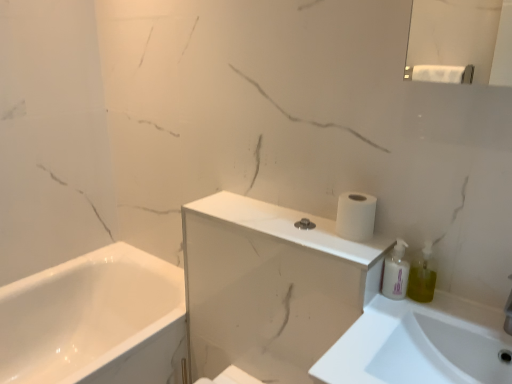
This screenshot has height=384, width=512. What do you see at coordinates (396, 273) in the screenshot?
I see `white glossy pump bottle at right` at bounding box center [396, 273].

Identify the location of white matte toilet paper at upper right. (355, 216).

What do you see at coordinates (270, 287) in the screenshot? I see `white glossy medicine cabinet at upper center` at bounding box center [270, 287].

Where is `white glossy medicine cabinet at upper center`? white glossy medicine cabinet at upper center is located at coordinates (270, 287).

Measure the distance between green translucent soap dispenser at right and camera.

They are 1.10 meters apart.

Locate an element on the screen. white glossy sink at lower right is located at coordinates (419, 344).

Where is `white glossy pump bottle at right`? The width and height of the screenshot is (512, 384). white glossy pump bottle at right is located at coordinates (396, 273).

Based on the photo, is green translucent soap dispenser at right not within white glossy medicine cabinet at upper center?

Indeed, green translucent soap dispenser at right is completely outside white glossy medicine cabinet at upper center.

From the picture: Is there a large distance between green translucent soap dispenser at right and white glossy medicine cabinet at upper center?

No, green translucent soap dispenser at right is not far from white glossy medicine cabinet at upper center.

Does green translucent soap dispenser at right turn towards white glossy medicine cabinet at upper center?

No.

From a real-world perspective, which object stands above the other?

green translucent soap dispenser at right.

From the image's perspective, which is above, white glossy pump bottle at right or white glossy sink at lower right?

white glossy pump bottle at right.

Based on the photo, does white glossy pump bottle at right appear on the left side of white glossy sink at lower right?

Incorrect, white glossy pump bottle at right is not on the left side of white glossy sink at lower right.

Is white glossy pump bottle at right positioned beyond the bounds of white glossy sink at lower right?

Yes, white glossy pump bottle at right is outside of white glossy sink at lower right.

Considering the relative sizes of white glossy pump bottle at right and white glossy sink at lower right in the image provided, is white glossy pump bottle at right thinner than white glossy sink at lower right?

Yes, white glossy pump bottle at right is thinner than white glossy sink at lower right.

Can you confirm if green translucent soap dispenser at right is bigger than white matte toilet paper at upper right?

Actually, green translucent soap dispenser at right might be smaller than white matte toilet paper at upper right.

Between green translucent soap dispenser at right and white matte toilet paper at upper right, which one is positioned in front?

green translucent soap dispenser at right.

Which of these two, green translucent soap dispenser at right or white matte toilet paper at upper right, stands shorter?

white matte toilet paper at upper right is shorter.

Between green translucent soap dispenser at right and white matte toilet paper at upper right, which one has smaller width?

With smaller width is green translucent soap dispenser at right.

You are a GUI agent. You are given a task and a screenshot of the screen. Output one action in this format:
    pyautogui.click(x=<x>, y=<y>)
    Task: Click on the toiletry on the right of the white matte toilet paper at upper right
    
    Given the screenshot: What is the action you would take?
    pyautogui.click(x=396, y=273)

Is white matte toilet paper at upper right turned away from white glossy pump bottle at right?

That's not correct — white matte toilet paper at upper right is not looking away from white glossy pump bottle at right.

Can you tell me how much white matte toilet paper at upper right and white glossy pump bottle at right differ in facing direction?

The angle between the facing direction of white matte toilet paper at upper right and the facing direction of white glossy pump bottle at right is 2.94 degrees.

Based on the photo, do you think white matte toilet paper at upper right is within white glossy pump bottle at right, or outside of it?

white matte toilet paper at upper right is located beyond the bounds of white glossy pump bottle at right.

Which point is more forward, (490,318) or (256,366)?

The point (490,318) is more forward.

Is white glossy sink at lower right positioned before white glossy medicine cabinet at upper center?

Yes, white glossy sink at lower right is closer to the viewer.

How different are the orientations of white glossy sink at lower right and white glossy medicine cabinet at upper center in degrees?

There is a 1.75-degree angle between the facing directions of white glossy sink at lower right and white glossy medicine cabinet at upper center.

From their relative heights in the image, would you say white glossy sink at lower right is taller or shorter than white glossy medicine cabinet at upper center?

white glossy sink at lower right is shorter than white glossy medicine cabinet at upper center.

Considering the positions of objects white glossy pump bottle at right and white matte toilet paper at upper right in the image provided, who is more to the right, white glossy pump bottle at right or white matte toilet paper at upper right?

white glossy pump bottle at right is more to the right.

Measure the distance between white glossy pump bottle at right and white matte toilet paper at upper right.

white glossy pump bottle at right and white matte toilet paper at upper right are 4.84 inches apart.

Is white glossy pump bottle at right turned away from white matte toilet paper at upper right?

white glossy pump bottle at right is not turned away from white matte toilet paper at upper right.

Is white glossy pump bottle at right positioned in front of white matte toilet paper at upper right?

Yes, it is in front of white matte toilet paper at upper right.

Considering the relative sizes of white matte toilet paper at upper right and white glossy sink at lower right in the image provided, is white matte toilet paper at upper right shorter than white glossy sink at lower right?

Yes.

Is white matte toilet paper at upper right touching white glossy sink at lower right?

No, white matte toilet paper at upper right is not in contact with white glossy sink at lower right.

Is point (353, 236) in front of point (359, 366)?

No, it is not.

The image size is (512, 384). I want to click on toilet paper above the white glossy sink at lower right (from the image's perspective), so click(x=355, y=216).

The image size is (512, 384). What are the coordinates of `medicine cabinet below the green translucent soap dispenser at right (from the image's perspective)` in the screenshot? It's located at (270, 287).

Identify the location of toiletry on the right of the white glossy sink at lower right. This screenshot has height=384, width=512. (396, 273).

Considering their positions, is white glossy sink at lower right positioned closer to white glossy pump bottle at right than white matte toilet paper at upper right?

The object closer to white glossy pump bottle at right is white matte toilet paper at upper right.

Estimate the real-world distances between objects in this image. Which object is closer to white glossy pump bottle at right, white glossy medicine cabinet at upper center or green translucent soap dispenser at right?

Based on the image, green translucent soap dispenser at right appears to be nearer to white glossy pump bottle at right.

Based on their spatial positions, is white matte toilet paper at upper right or white glossy sink at lower right closer to white glossy medicine cabinet at upper center?

white glossy sink at lower right is closer to white glossy medicine cabinet at upper center.

Which object lies further to the anchor point green translucent soap dispenser at right, white glossy medicine cabinet at upper center or white matte toilet paper at upper right?

Based on the image, white glossy medicine cabinet at upper center appears to be further to green translucent soap dispenser at right.

Which object lies further to the anchor point white glossy sink at lower right, white glossy medicine cabinet at upper center or white glossy pump bottle at right?

The object further to white glossy sink at lower right is white glossy medicine cabinet at upper center.

Which object lies further to the anchor point white matte toilet paper at upper right, green translucent soap dispenser at right or white glossy medicine cabinet at upper center?

white glossy medicine cabinet at upper center is positioned further to the anchor white matte toilet paper at upper right.

When comparing their distances from white glossy medicine cabinet at upper center, does white glossy pump bottle at right or white glossy sink at lower right seem further?

white glossy pump bottle at right lies further to white glossy medicine cabinet at upper center than the other object.

Which object lies nearer to the anchor point white glossy sink at lower right, white glossy pump bottle at right or green translucent soap dispenser at right?

white glossy pump bottle at right is positioned closer to the anchor white glossy sink at lower right.

This screenshot has height=384, width=512. In order to click on toiletry between white matte toilet paper at upper right and green translucent soap dispenser at right from left to right in this screenshot , I will do `click(396, 273)`.

Where is `toiletry between white matte toilet paper at upper right and white glossy medicine cabinet at upper center in the up-down direction`? toiletry between white matte toilet paper at upper right and white glossy medicine cabinet at upper center in the up-down direction is located at coordinates (396, 273).

The image size is (512, 384). In order to click on soap dispenser located between white glossy sink at lower right and white matte toilet paper at upper right in the depth direction in this screenshot , I will do `click(423, 275)`.

Locate an element on the screen. Image resolution: width=512 pixels, height=384 pixels. medicine cabinet between white glossy sink at lower right and white glossy pump bottle at right along the z-axis is located at coordinates (270, 287).